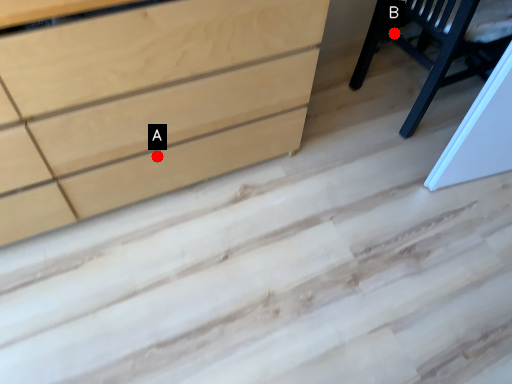
Question: Two points are circled on the image, labeled by A and B beside each circle. Which point appears farthest from the camera in this image?

Choices:
 (A) A is further
 (B) B is further

Answer: (B)